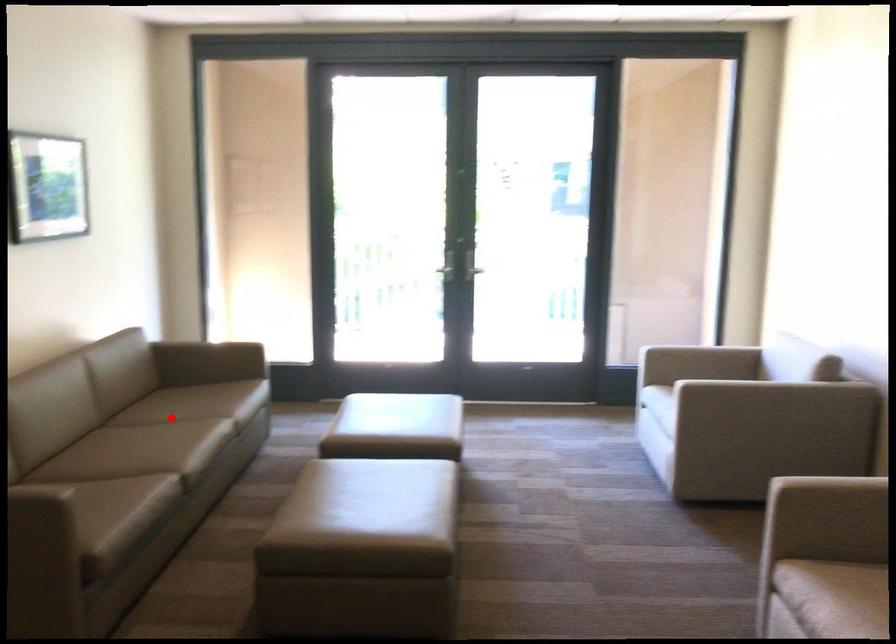
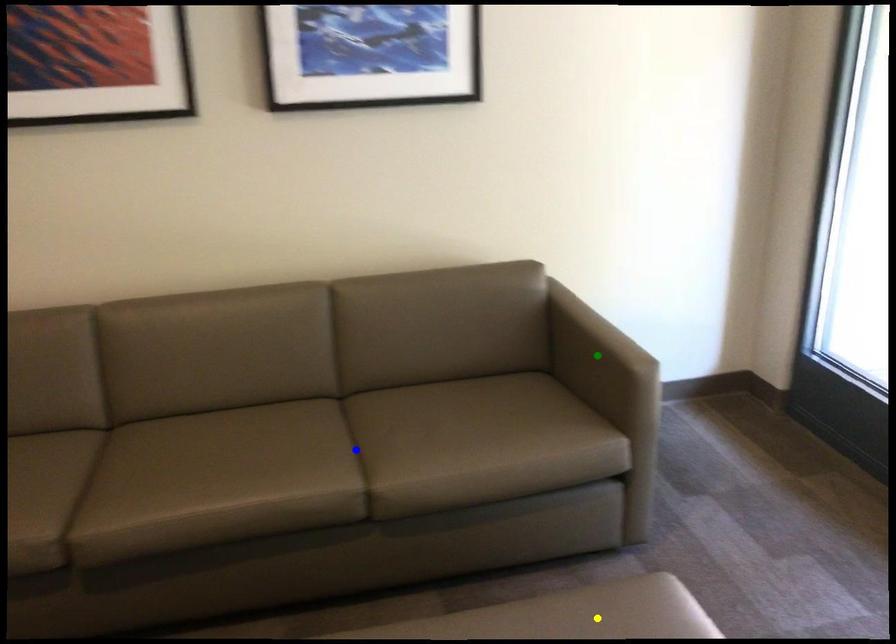
Question: I am providing you with two images of the same scene from different viewpoints. A red point is marked on the first image. You are given multiple points on the second image. Which mark in image 2 goes with the point in image 1?

Choices:
 (A) blue point
 (B) yellow point
 (C) green point

Answer: (A)